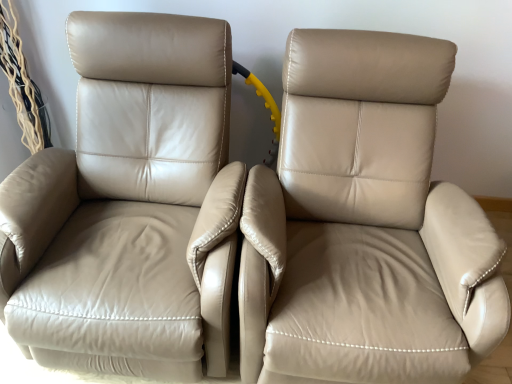
Question: From a real-world perspective, is beige leather chair at center, which is the second chair in left-to-right order, physically located above or below beige leather chair at left, the second chair viewed from the right?

Choices:
 (A) above
 (B) below

Answer: (B)

Question: Looking at the image, does beige leather chair at center, acting as the first chair starting from the right, seem bigger or smaller compared to beige leather chair at left, the second chair viewed from the right?

Choices:
 (A) big
 (B) small

Answer: (A)

Question: Do you think beige leather chair at center, which is the second chair in left-to-right order, is within beige leather chair at left, the second chair viewed from the right, or outside of it?

Choices:
 (A) inside
 (B) outside

Answer: (B)

Question: Would you say beige leather chair at left, the second chair viewed from the right, is inside or outside beige leather chair at center, which is the second chair in left-to-right order?

Choices:
 (A) inside
 (B) outside

Answer: (B)

Question: From the image's perspective, is beige leather chair at left, positioned as the 1th chair in left-to-right order, located above or below beige leather chair at center, acting as the first chair starting from the right?

Choices:
 (A) below
 (B) above

Answer: (B)

Question: Is point (219, 296) positioned closer to the camera than point (429, 248)?

Choices:
 (A) farther
 (B) closer

Answer: (B)

Question: Relative to beige leather chair at center, acting as the first chair starting from the right, is beige leather chair at left, positioned as the 1th chair in left-to-right order, in front or behind?

Choices:
 (A) behind
 (B) front

Answer: (A)